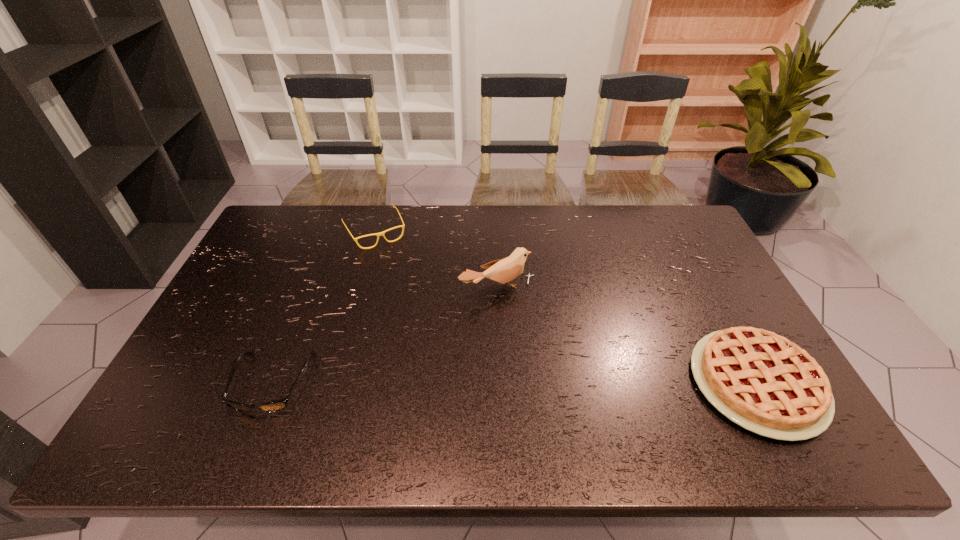
Find the location of a particular element. Image resolution: width=960 pixels, height=540 pixels. vacant space at the near edge of the desktop is located at coordinates (256, 394).

Find the location of `vacant space at the left edge`. vacant space at the left edge is located at coordinates (217, 326).

Identify the location of free space at the right edge of the desktop. (664, 252).

This screenshot has height=540, width=960. I want to click on free location at the far left corner of the desktop, so click(x=288, y=206).

Where is `vacant area at the far right corner of the desktop`? vacant area at the far right corner of the desktop is located at coordinates (667, 223).

Locate an element on the screen. The height and width of the screenshot is (540, 960). vacant area between the farther spectacles and the bird is located at coordinates (436, 260).

At what (x,y) coordinates should I click in order to perform the action: click on free spot between the nearer spectacles and the farther spectacles. Please return your answer as a coordinate pair (x, y). Looking at the image, I should click on (324, 307).

The height and width of the screenshot is (540, 960). Identify the location of empty location between the tallest object and the nearer spectacles. (385, 336).

Image resolution: width=960 pixels, height=540 pixels. In order to click on free space that is in between the farthest object and the pie in this screenshot , I will do `click(565, 307)`.

The width and height of the screenshot is (960, 540). What are the coordinates of `free spot between the third nearest object and the rightmost object` in the screenshot? It's located at (627, 336).